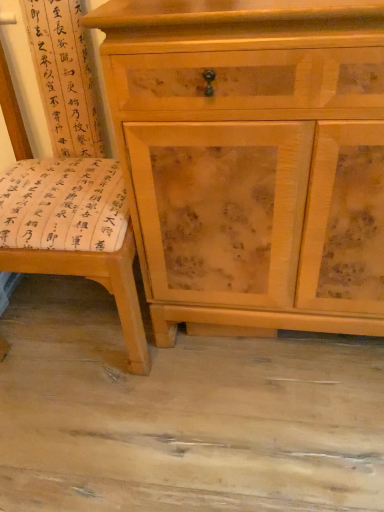
Question: In the image, is light wood cabinet at center positioned in front of or behind wooden swivel chair at left?

Choices:
 (A) behind
 (B) front

Answer: (A)

Question: From the image's perspective, relative to wooden swivel chair at left, is light wood cabinet at center above or below?

Choices:
 (A) below
 (B) above

Answer: (B)

Question: Is point (294, 179) closer or farther from the camera than point (124, 335)?

Choices:
 (A) closer
 (B) farther

Answer: (A)

Question: Considering the positions of wooden swivel chair at left and light wood cabinet at center in the image, is wooden swivel chair at left bigger or smaller than light wood cabinet at center?

Choices:
 (A) big
 (B) small

Answer: (B)

Question: Which is correct: wooden swivel chair at left is inside light wood cabinet at center, or outside of it?

Choices:
 (A) outside
 (B) inside

Answer: (A)

Question: In terms of height, does wooden swivel chair at left look taller or shorter compared to light wood cabinet at center?

Choices:
 (A) short
 (B) tall

Answer: (B)

Question: Relative to light wood cabinet at center, is wooden swivel chair at left in front or behind?

Choices:
 (A) behind
 (B) front

Answer: (B)